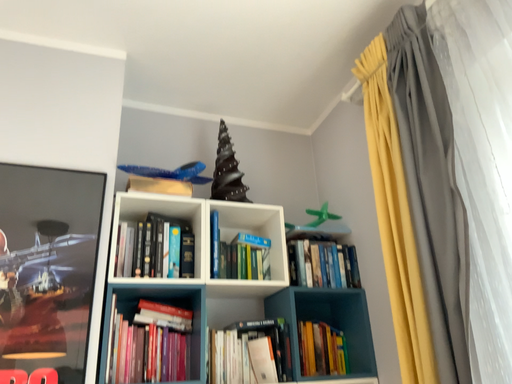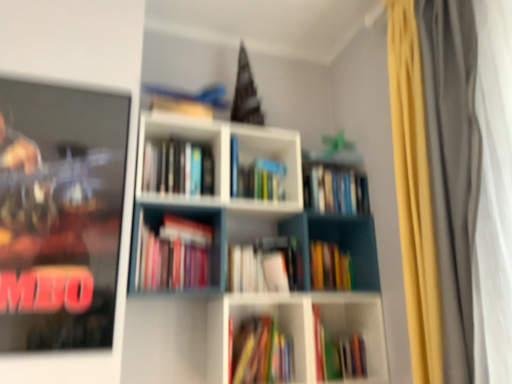
Question: Which way did the camera rotate in the video?

Choices:
 (A) rotated upward
 (B) rotated downward

Answer: (B)